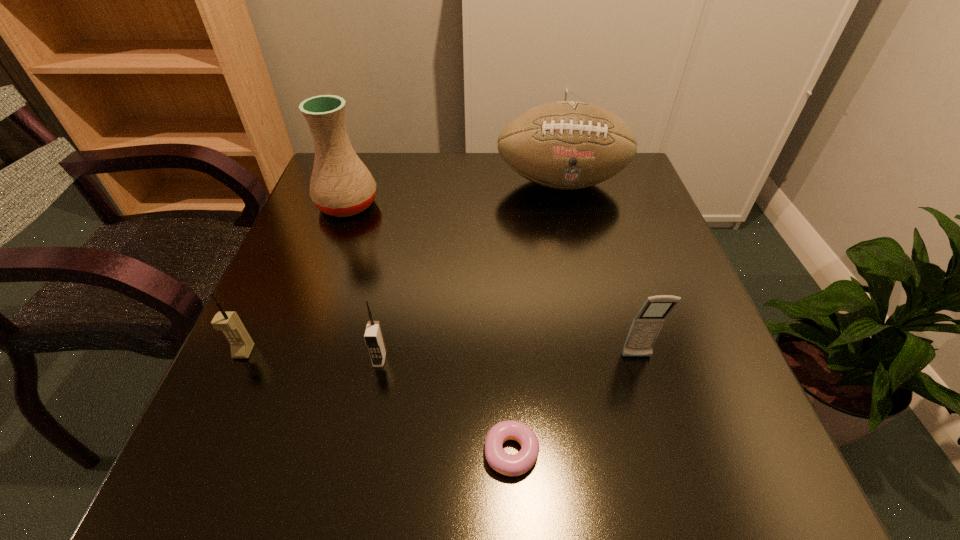
I want to click on free space between the third object from left to right and the second tallest object, so click(x=470, y=271).

Find the location of `vacant area between the rightmost cellular telephone and the football (American)`. vacant area between the rightmost cellular telephone and the football (American) is located at coordinates (599, 270).

The image size is (960, 540). I want to click on vacant point located between the tallest object and the nearest object, so click(x=429, y=328).

Where is `empty location between the second cellular telephone from right to left and the football (American)`? The height and width of the screenshot is (540, 960). empty location between the second cellular telephone from right to left and the football (American) is located at coordinates (470, 271).

You are a GUI agent. You are given a task and a screenshot of the screen. Output one action in this format:
    pyautogui.click(x=<x>, y=<y>)
    Task: Click on the unoccupied area between the leftmost cellular telephone and the shortest object
    The width and height of the screenshot is (960, 540).
    Given the screenshot: What is the action you would take?
    pyautogui.click(x=378, y=402)

You are a GUI agent. You are given a task and a screenshot of the screen. Output one action in this format:
    pyautogui.click(x=<x>, y=<y>)
    Task: Click on the vacant space that is in between the leftmost cellular telephone and the second cellular telephone from right to left
    The image size is (960, 540).
    Given the screenshot: What is the action you would take?
    pyautogui.click(x=312, y=355)

You are a GUI agent. You are given a task and a screenshot of the screen. Output one action in this format:
    pyautogui.click(x=<x>, y=<y>)
    Task: Click on the free spot between the football (American) and the rightmost cellular telephone
    
    Given the screenshot: What is the action you would take?
    pyautogui.click(x=599, y=270)

The height and width of the screenshot is (540, 960). I want to click on the third closest object relative to the rightmost cellular telephone, so click(x=566, y=145).

Identify which object is the fourth nearest to the rightmost cellular telephone. Please provide its 2D coordinates. Your answer should be formatted as a tuple, i.e. [(x, y)], where the tuple contains the x and y coordinates of a point satisfying the conditions above.

[(341, 185)]

Identify which cellular telephone is located as the nearest to the leftmost cellular telephone. Please provide its 2D coordinates. Your answer should be formatted as a tuple, i.e. [(x, y)], where the tuple contains the x and y coordinates of a point satisfying the conditions above.

[(373, 336)]